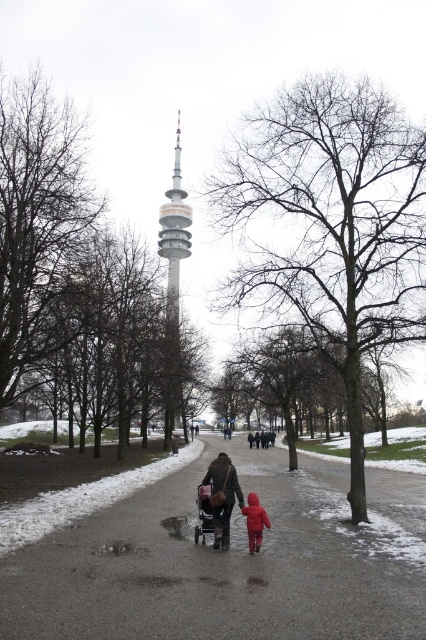
You are standing at the edge of the paved pathway in the winter scene. You see the silver metallic tower at center and the dark brown leather jacket at center. Which object is bigger?

The silver metallic tower at center is larger than the dark brown leather jacket at center.